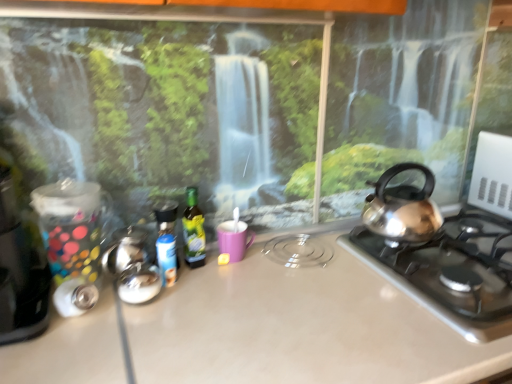
What are the coordinates of `vacant area that is in front of green glass bottle at center, the 2th bottle in the left-to-right sequence` in the screenshot? It's located at tap(199, 301).